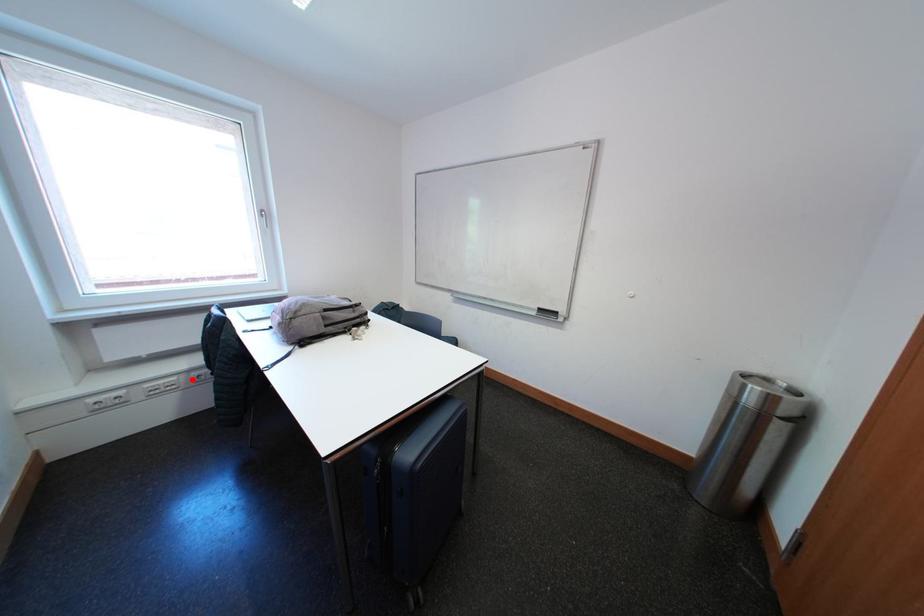
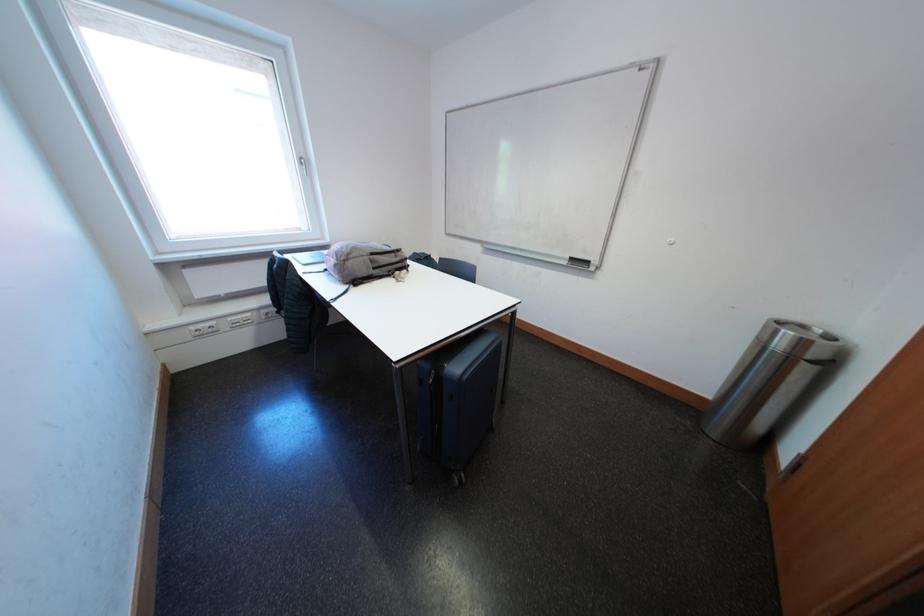
The point at the highlighted location is marked in the first image. Where is the corresponding point in the second image?

(264, 315)